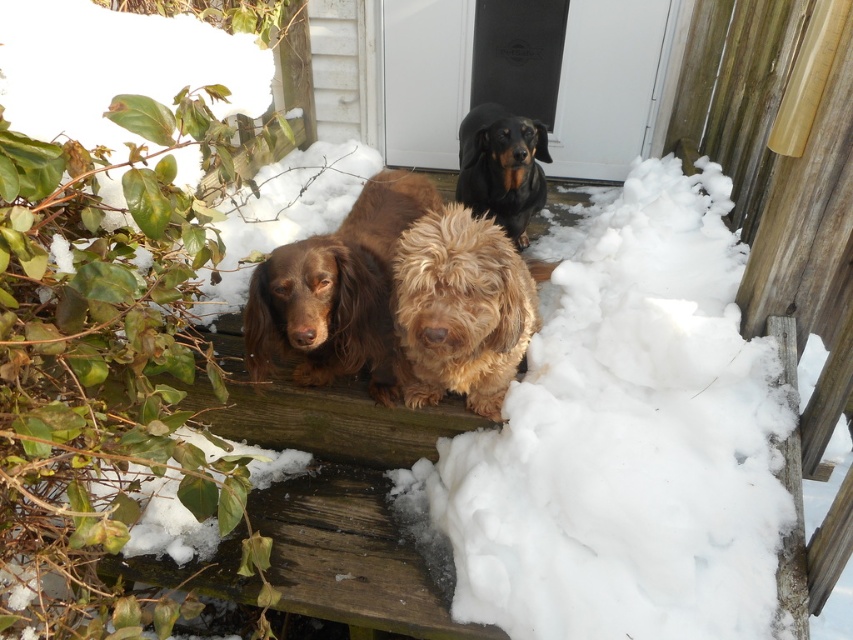
Question: Which object appears farthest from the camera in this image?

Choices:
 (A) black shiny coat at upper center
 (B) white fluffy snow at center

Answer: (A)

Question: Among these objects, which one is farthest from the camera?

Choices:
 (A) black shiny coat at upper center
 (B) fuzzy golden dog at center
 (C) white fluffy snow at center
 (D) brown shaggy dog at center

Answer: (A)

Question: Does white fluffy snow at center come behind fuzzy golden dog at center?

Choices:
 (A) no
 (B) yes

Answer: (B)

Question: Does white fluffy snow at center have a greater width compared to brown shaggy dog at center?

Choices:
 (A) yes
 (B) no

Answer: (A)

Question: Does white fluffy snow at center appear under brown shaggy dog at center?

Choices:
 (A) yes
 (B) no

Answer: (A)

Question: Estimate the real-world distances between objects in this image. Which object is farther from the brown shaggy dog at center?

Choices:
 (A) white fluffy snow at center
 (B) black shiny coat at upper center
 (C) fuzzy golden dog at center

Answer: (A)